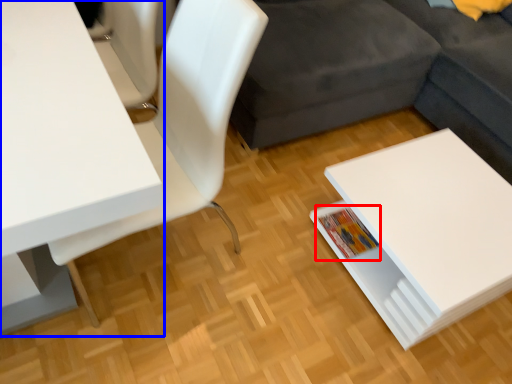
Question: Which point is further to the camera, book (highlighted by a red box) or table (highlighted by a blue box)?

Choices:
 (A) book
 (B) table

Answer: (A)